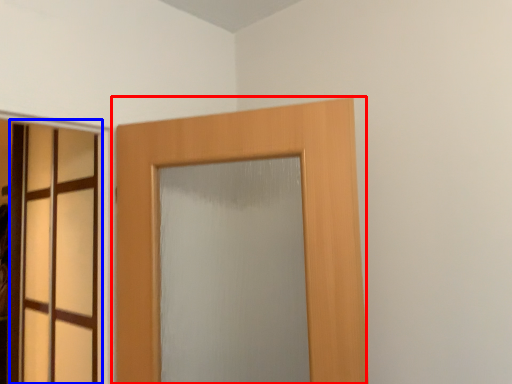
Question: Which point is further to the camera, door (highlighted by a red box) or door (highlighted by a blue box)?

Choices:
 (A) door
 (B) door

Answer: (B)